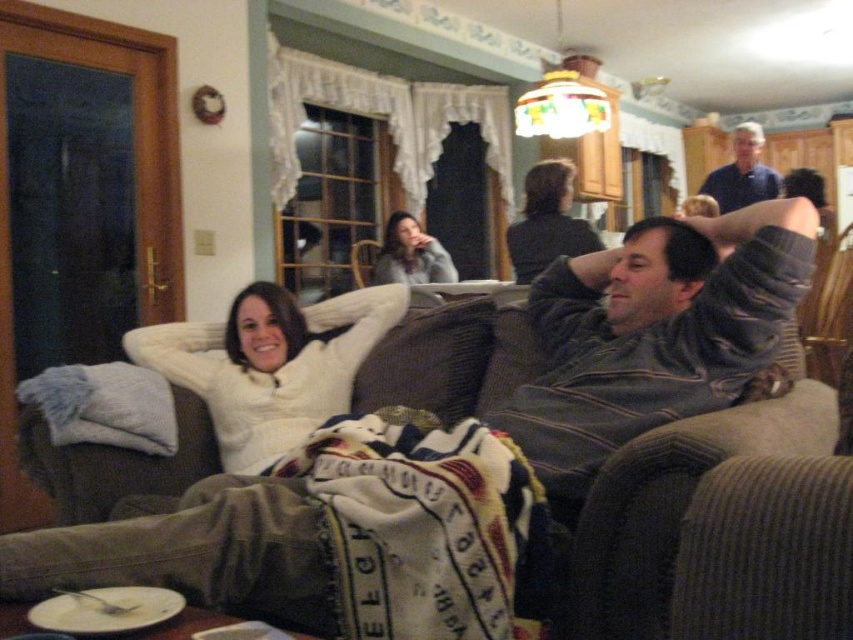
Who is taller, gray striped sweater at center or multicolored woven blanket at lower center?

gray striped sweater at center

Does gray striped sweater at center appear on the right side of multicolored woven blanket at lower center?

Yes, gray striped sweater at center is to the right of multicolored woven blanket at lower center.

Is point (583, 490) less distant than point (409, 435)?

Yes, point (583, 490) is in front of point (409, 435).

At what (x,y) coordinates should I click in order to perform the action: click on gray striped sweater at center. Please return your answer as a coordinate pair (x, y). The width and height of the screenshot is (853, 640). Looking at the image, I should click on (654, 333).

Is gray striped sweater at center to the left of matte gray sweater at center from the viewer's perspective?

In fact, gray striped sweater at center is to the right of matte gray sweater at center.

Does gray striped sweater at center have a greater width compared to matte gray sweater at center?

Correct, the width of gray striped sweater at center exceeds that of matte gray sweater at center.

Which is behind, point (613, 348) or point (376, 266)?

The point (376, 266) is behind.

Find the location of `gray striped sweater at center`. gray striped sweater at center is located at coordinates (654, 333).

In the scene shown: Is dark gray corduroy couch at center wider than white fuzzy sweater at center?

No, dark gray corduroy couch at center is not wider than white fuzzy sweater at center.

Is dark gray corduroy couch at center above white fuzzy sweater at center?

Incorrect, dark gray corduroy couch at center is not positioned above white fuzzy sweater at center.

Which is in front, point (183, 435) or point (223, 372)?

Point (183, 435) is in front.

Locate an element on the screen. This screenshot has height=640, width=853. dark gray corduroy couch at center is located at coordinates (672, 504).